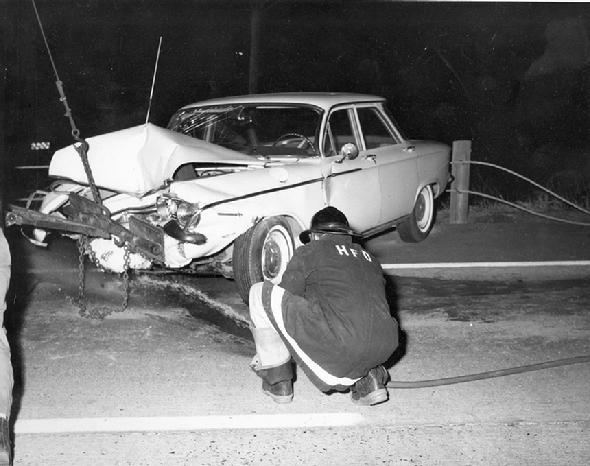
Locate an element on the screen. The width and height of the screenshot is (590, 466). left mirror is located at coordinates (345, 157).